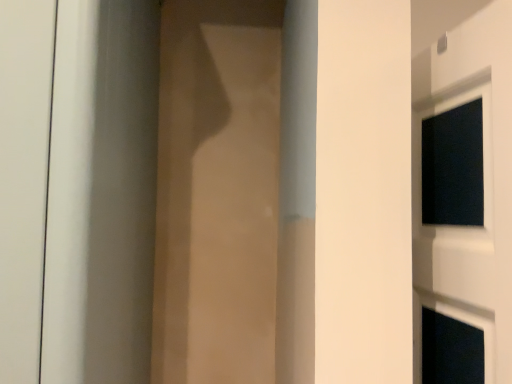
Image resolution: width=512 pixels, height=384 pixels. I want to click on black matte door at right, so click(483, 182).

Describe the element at coordinates (483, 182) in the screenshot. I see `black matte door at right` at that location.

You are a GUI agent. You are given a task and a screenshot of the screen. Output one action in this format:
    pyautogui.click(x=<x>, y=<y>)
    Task: Click on the black matte door at right
    The height and width of the screenshot is (384, 512).
    Given the screenshot: What is the action you would take?
    pyautogui.click(x=483, y=182)